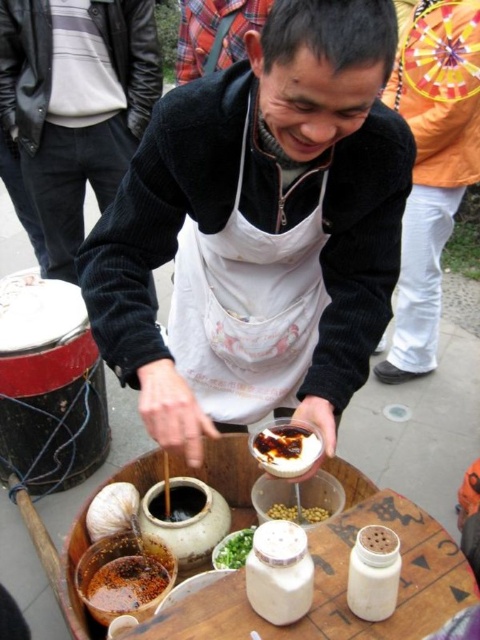
Question: Can you confirm if white matte apron at center is wider than matte black apron at center?

Choices:
 (A) yes
 (B) no

Answer: (A)

Question: Which point is closer to the camera?

Choices:
 (A) white matte apron at center
 (B) green leafy vegetable at center
 (C) savory brown sauce at center

Answer: (A)

Question: Can you confirm if white matte apron at center is wider than savory brown sauce at center?

Choices:
 (A) yes
 (B) no

Answer: (A)

Question: Which object appears farthest from the camera in this image?

Choices:
 (A) brown matte sauce at center
 (B) savory brown sauce at center

Answer: (A)

Question: Which is nearer to the savory brown sauce at center?

Choices:
 (A) brown matte clay pot at lower left
 (B) green leafy vegetable at center

Answer: (B)

Question: Does matte black apron at center have a greater width compared to brown matte clay pot at lower left?

Choices:
 (A) yes
 (B) no

Answer: (A)